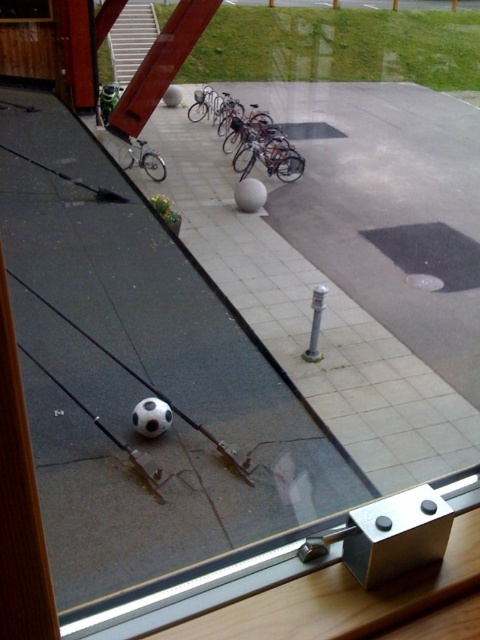
Does shiny metallic bicycles at center have a lesser width compared to silver metallic bicycle at center?

No, shiny metallic bicycles at center is not thinner than silver metallic bicycle at center.

From the picture: Which is more to the left, shiny metallic bicycles at center or silver metallic bicycle at center?

Positioned to the left is silver metallic bicycle at center.

Who is more forward, (303, 157) or (132, 156)?

Point (132, 156) is in front.

The width and height of the screenshot is (480, 640). Identify the location of shiny metallic bicycles at center. (257, 141).

Which is in front, point (106, 163) or point (144, 170)?

Point (106, 163) is in front.

Can you confirm if transparent glass door at center is positioned to the left of silver metallic bicycle at center?

No, transparent glass door at center is not to the left of silver metallic bicycle at center.

Which is behind, point (108, 365) or point (145, 164)?

The point (145, 164) is more distant.

The image size is (480, 640). Find the location of `transparent glass door at center`. transparent glass door at center is located at coordinates (142, 376).

The image size is (480, 640). What do you see at coordinates (257, 141) in the screenshot?
I see `shiny metallic bicycles at center` at bounding box center [257, 141].

Does shiny metallic bicycles at center have a lesser width compared to transparent glass window at upper left?

Incorrect, shiny metallic bicycles at center's width is not less than transparent glass window at upper left's.

Locate an element on the screen. This screenshot has height=640, width=480. shiny metallic bicycles at center is located at coordinates (257, 141).

This screenshot has width=480, height=640. I want to click on shiny metallic bicycles at center, so click(x=257, y=141).